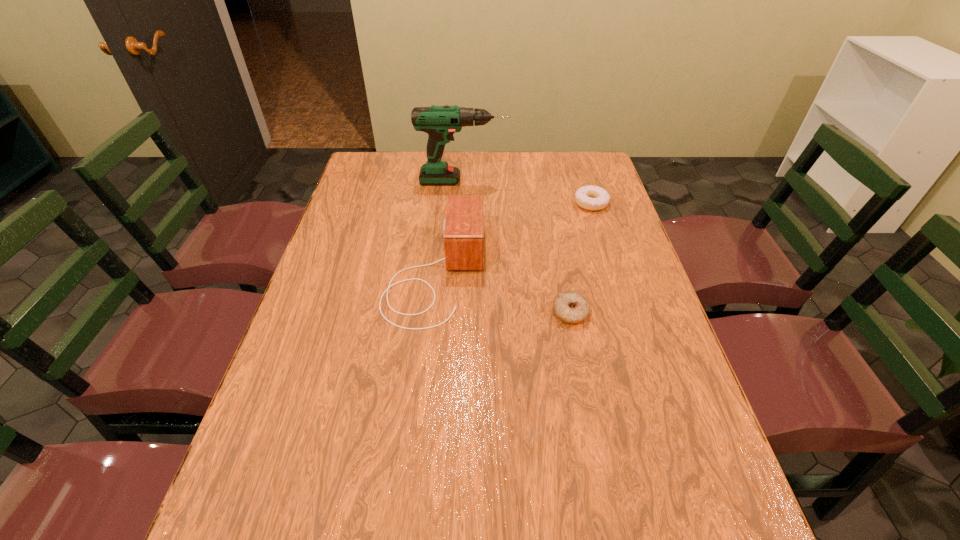
Locate an element on the screen. The height and width of the screenshot is (540, 960). drill is located at coordinates point(440,122).

This screenshot has height=540, width=960. What are the coordinates of `the farthest object` in the screenshot? It's located at tap(440, 122).

Locate an element on the screen. the second tallest object is located at coordinates (463, 226).

The width and height of the screenshot is (960, 540). Identify the location of the right doughnut. (593, 198).

At what (x,y) coordinates should I click in order to perform the action: click on the second farthest object. Please return your answer as a coordinate pair (x, y). The height and width of the screenshot is (540, 960). Looking at the image, I should click on (593, 198).

Where is `the nearer doughnut`? The image size is (960, 540). the nearer doughnut is located at coordinates (570, 307).

At what (x,y) coordinates should I click in order to perform the action: click on the second object from right to left. Please return your answer as a coordinate pair (x, y). Looking at the image, I should click on (570, 307).

I want to click on free space located 0.240m on the handle side of the drill, so click(576, 181).

You are a GUI agent. You are given a task and a screenshot of the screen. Output one action in this format:
    pyautogui.click(x=<x>, y=<y>)
    Task: Click on the vacant space located 0.250m on the front-facing side of the third shortest object
    
    Given the screenshot: What is the action you would take?
    pyautogui.click(x=574, y=273)

I want to click on free region located on the front of the rightmost object, so click(x=612, y=268).